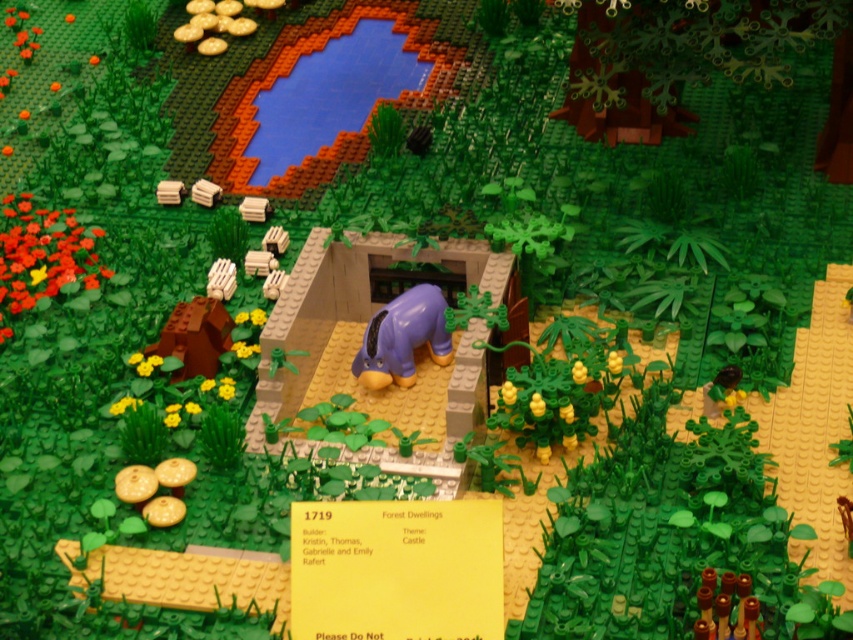
Question: Which object appears farthest from the camera in this image?

Choices:
 (A) matte purple elephant at center
 (B) matte brown brick at center-left

Answer: (B)

Question: Can you confirm if matte purple elephant at center is positioned above wooden block at upper left?

Choices:
 (A) no
 (B) yes

Answer: (A)

Question: Which object appears closest to the camera in this image?

Choices:
 (A) matte purple elephant at center
 (B) wooden block at upper left

Answer: (A)

Question: Which object is positioned farthest from the matte purple elephant at center?

Choices:
 (A) wooden crates at upper center
 (B) wooden block at upper left
 (C) matte brown brick at center-left
 (D) brown matte house at lower left

Answer: (B)

Question: Can you confirm if matte brown brick at center-left is wider than wooden block at upper left?

Choices:
 (A) yes
 (B) no

Answer: (B)

Question: Is matte purple elephant at center behind wooden block at upper left?

Choices:
 (A) no
 (B) yes

Answer: (A)